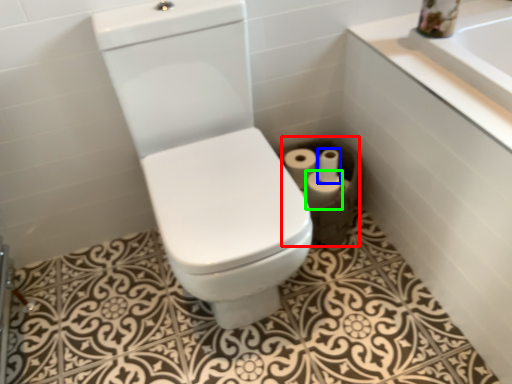
Question: Considering the real-world distances, which object is closest to toilet paper (highlighted by a red box)? toilet paper (highlighted by a blue box) or toilet paper (highlighted by a green box).

Choices:
 (A) toilet paper
 (B) toilet paper

Answer: (B)